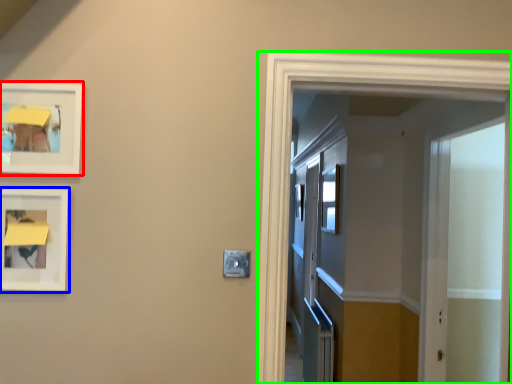
Question: Which object is the farthest from picture frame (highlighted by a red box)? Choose among these: picture frame (highlighted by a blue box) or elevator (highlighted by a green box).

Choices:
 (A) picture frame
 (B) elevator

Answer: (B)